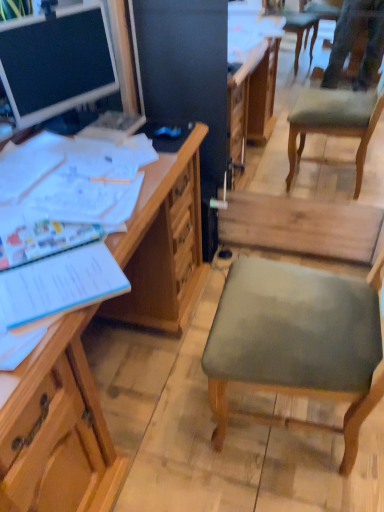
The image size is (384, 512). What do you see at coordinates (59, 285) in the screenshot? I see `blue paper notebook at left` at bounding box center [59, 285].

What is the approximate height of wooden desk at left, the 2th desk from the top?

It is 30.27 inches.

Where is `wooden desk at left, which appears as the first desk when ordered from the bottom`? The width and height of the screenshot is (384, 512). wooden desk at left, which appears as the first desk when ordered from the bottom is located at coordinates (86, 358).

Locate an element on the screen. This screenshot has height=512, width=384. matte wooden desk at upper left, which is counted as the second desk, starting from the bottom is located at coordinates (56, 63).

Is matte wooden desk at upper left, the 1th desk in the top-to-bottom sequence, positioned with its back to blue paper notebook at left?

matte wooden desk at upper left, the 1th desk in the top-to-bottom sequence, does not have its back to blue paper notebook at left.

In the scene shown: Is matte wooden desk at upper left, the 1th desk in the top-to-bottom sequence, not inside blue paper notebook at left?

That's correct, matte wooden desk at upper left, the 1th desk in the top-to-bottom sequence, is outside of blue paper notebook at left.

Looking at this image, between matte wooden desk at upper left, which is counted as the second desk, starting from the bottom, and blue paper notebook at left, which one appears on the left side from the viewer's perspective?

From the viewer's perspective, matte wooden desk at upper left, which is counted as the second desk, starting from the bottom, appears more on the left side.

From the picture: Which point is more forward, (38, 27) or (63, 258)?

The point (63, 258) is in front.

Which object is further away from the camera, wooden desk at left, the 2th desk from the top, or matte wooden desk at upper left, which is counted as the second desk, starting from the bottom?

Positioned behind is matte wooden desk at upper left, which is counted as the second desk, starting from the bottom.

Is wooden desk at left, the 2th desk from the top, not within matte wooden desk at upper left, the 1th desk in the top-to-bottom sequence?

Absolutely, wooden desk at left, the 2th desk from the top, is external to matte wooden desk at upper left, the 1th desk in the top-to-bottom sequence.

Is wooden desk at left, which appears as the first desk when ordered from the bottom, looking in the opposite direction of matte wooden desk at upper left, which is counted as the second desk, starting from the bottom?

No, wooden desk at left, which appears as the first desk when ordered from the bottom, is not facing away from matte wooden desk at upper left, which is counted as the second desk, starting from the bottom.

Between wooden desk at left, which appears as the first desk when ordered from the bottom, and blue paper notebook at left, which one appears on the right side from the viewer's perspective?

Positioned to the right is blue paper notebook at left.

Is wooden desk at left, the 2th desk from the top, positioned in front of blue paper notebook at left?

Yes, it is.

You are a GUI agent. You are given a task and a screenshot of the screen. Output one action in this format:
    pyautogui.click(x=<x>, y=<y>)
    Task: Click on the desk below the blue paper notebook at left (from the image's perspective)
    
    Given the screenshot: What is the action you would take?
    pyautogui.click(x=86, y=358)

Is matte wooden desk at upper left, the 1th desk in the top-to-bottom sequence, turned away from wooden desk at left, which appears as the first desk when ordered from the bottom?

matte wooden desk at upper left, the 1th desk in the top-to-bottom sequence, is not turned away from wooden desk at left, which appears as the first desk when ordered from the bottom.

Which is behind, matte wooden desk at upper left, the 1th desk in the top-to-bottom sequence, or wooden desk at left, which appears as the first desk when ordered from the bottom?

matte wooden desk at upper left, the 1th desk in the top-to-bottom sequence.

Are matte wooden desk at upper left, which is counted as the second desk, starting from the bottom, and wooden desk at left, which appears as the first desk when ordered from the bottom, located far from each other?

No, there isn't a large distance between matte wooden desk at upper left, which is counted as the second desk, starting from the bottom, and wooden desk at left, which appears as the first desk when ordered from the bottom.

This screenshot has height=512, width=384. Identify the location of desk below the matte wooden desk at upper left, the 1th desk in the top-to-bottom sequence (from a real-world perspective). (86, 358).

Looking at this image, from a real-world perspective, is blue paper notebook at left positioned above or below matte wooden desk at upper left, the 1th desk in the top-to-bottom sequence?

blue paper notebook at left is below matte wooden desk at upper left, the 1th desk in the top-to-bottom sequence.

Looking at this image, is blue paper notebook at left far from matte wooden desk at upper left, which is counted as the second desk, starting from the bottom?

Actually, blue paper notebook at left and matte wooden desk at upper left, which is counted as the second desk, starting from the bottom, are a little close together.

You are a GUI agent. You are given a task and a screenshot of the screen. Output one action in this format:
    pyautogui.click(x=<x>, y=<y>)
    Task: Click on the desk above the blue paper notebook at left (from the image's perspective)
    
    Given the screenshot: What is the action you would take?
    pyautogui.click(x=56, y=63)

Considering the relative sizes of blue paper notebook at left and matte wooden desk at upper left, which is counted as the second desk, starting from the bottom, in the image provided, is blue paper notebook at left smaller than matte wooden desk at upper left, which is counted as the second desk, starting from the bottom,?

Indeed, blue paper notebook at left has a smaller size compared to matte wooden desk at upper left, which is counted as the second desk, starting from the bottom.

Is point (29, 266) positioned in front of point (197, 219)?

Yes, it is.

Is blue paper notebook at left wider or thinner than wooden desk at left, the 2th desk from the top?

Considering their sizes, blue paper notebook at left looks slimmer than wooden desk at left, the 2th desk from the top.

Based on the photo, from a real-world perspective, is blue paper notebook at left above or below wooden desk at left, which appears as the first desk when ordered from the bottom?

Clearly, from a real-world perspective, blue paper notebook at left is above wooden desk at left, which appears as the first desk when ordered from the bottom.

Who is more distant, blue paper notebook at left or wooden desk at left, which appears as the first desk when ordered from the bottom?

blue paper notebook at left is further away from the camera.

Locate an element on the screen. notebook located below the matte wooden desk at upper left, which is counted as the second desk, starting from the bottom (from the image's perspective) is located at coordinates (59, 285).

The width and height of the screenshot is (384, 512). Identify the location of desk above the wooden desk at left, which appears as the first desk when ordered from the bottom (from a real-world perspective). (56, 63).

Based on their spatial positions, is matte wooden desk at upper left, the 1th desk in the top-to-bottom sequence, or blue paper notebook at left further from wooden desk at left, which appears as the first desk when ordered from the bottom?

matte wooden desk at upper left, the 1th desk in the top-to-bottom sequence.

Which object lies further to the anchor point wooden desk at left, which appears as the first desk when ordered from the bottom, blue paper notebook at left or matte wooden desk at upper left, which is counted as the second desk, starting from the bottom?

matte wooden desk at upper left, which is counted as the second desk, starting from the bottom, lies further to wooden desk at left, which appears as the first desk when ordered from the bottom, than the other object.

Looking at the image, which one is located further to blue paper notebook at left, wooden desk at left, the 2th desk from the top, or matte wooden desk at upper left, which is counted as the second desk, starting from the bottom?

The object further to blue paper notebook at left is matte wooden desk at upper left, which is counted as the second desk, starting from the bottom.

When comparing their distances from matte wooden desk at upper left, which is counted as the second desk, starting from the bottom, does blue paper notebook at left or wooden desk at left, which appears as the first desk when ordered from the bottom, seem closer?

The object closer to matte wooden desk at upper left, which is counted as the second desk, starting from the bottom, is wooden desk at left, which appears as the first desk when ordered from the bottom.

Based on their spatial positions, is wooden desk at left, the 2th desk from the top, or blue paper notebook at left closer to matte wooden desk at upper left, the 1th desk in the top-to-bottom sequence?

wooden desk at left, the 2th desk from the top, is closer to matte wooden desk at upper left, the 1th desk in the top-to-bottom sequence.

Which object lies further to the anchor point blue paper notebook at left, matte wooden desk at upper left, which is counted as the second desk, starting from the bottom, or wooden desk at left, the 2th desk from the top?

matte wooden desk at upper left, which is counted as the second desk, starting from the bottom, is further to blue paper notebook at left.

Locate an element on the screen. Image resolution: width=384 pixels, height=512 pixels. notebook between matte wooden desk at upper left, the 1th desk in the top-to-bottom sequence, and wooden desk at left, the 2th desk from the top, in the up-down direction is located at coordinates (59, 285).